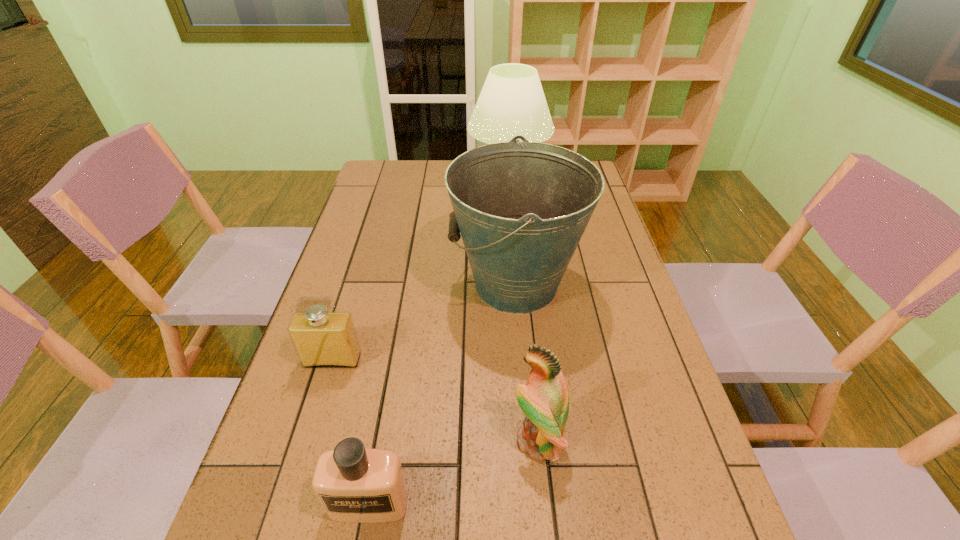
In the image, there is a desktop. Where is `vacant space at the far edge`? Image resolution: width=960 pixels, height=540 pixels. vacant space at the far edge is located at coordinates (426, 163).

At what (x,y) coordinates should I click in order to perform the action: click on free space at the left edge. Please return your answer as a coordinate pair (x, y). Looking at the image, I should click on (388, 200).

Find the location of a particular element. free region at the right edge of the desktop is located at coordinates (594, 348).

The width and height of the screenshot is (960, 540). I want to click on vacant space in between the farthest object and the leftmost object, so click(420, 270).

Identify the location of vacant space that is in between the nearer perfume and the third nearest object. The image size is (960, 540). (350, 431).

Where is `vacant space in between the nearest object and the second nearest object`? vacant space in between the nearest object and the second nearest object is located at coordinates (453, 471).

You are a GUI agent. You are given a task and a screenshot of the screen. Output one action in this format:
    pyautogui.click(x=<x>, y=<y>)
    Task: Click on the free space between the second farthest object and the farther perfume
    The width and height of the screenshot is (960, 540).
    Given the screenshot: What is the action you would take?
    pyautogui.click(x=424, y=322)

I want to click on unoccupied area between the third farthest object and the second object from left to right, so click(350, 431).

Find the location of `empty space that is in between the third farthest object and the nearer perfume`. empty space that is in between the third farthest object and the nearer perfume is located at coordinates (350, 431).

Identify the location of vacant area that lies between the third tallest object and the right perfume. The width and height of the screenshot is (960, 540). (453, 471).